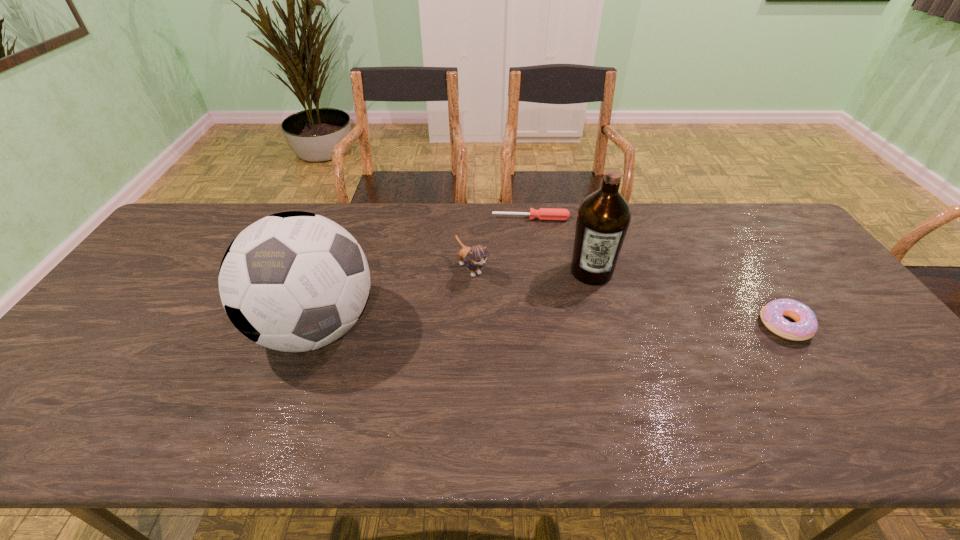
This screenshot has height=540, width=960. In order to click on free space on the desktop that is between the leftmost object and the fourth tallest object and is positioned at the tip of the shortest object in this screenshot , I will do click(x=538, y=326).

The image size is (960, 540). I want to click on vacant space on the desktop that is between the soccer ball and the rightmost object and is positioned on the front-facing side of the second object from left to right, so click(x=522, y=326).

This screenshot has width=960, height=540. I want to click on vacant spot on the desktop that is between the soccer ball and the doughnut and is positioned on the label of the olive oil, so click(592, 326).